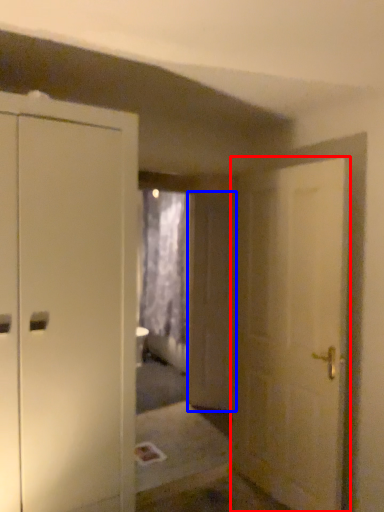
Question: Which object appears closest to the camera in this image, door (highlighted by a red box) or screen door (highlighted by a blue box)?

Choices:
 (A) door
 (B) screen door

Answer: (A)